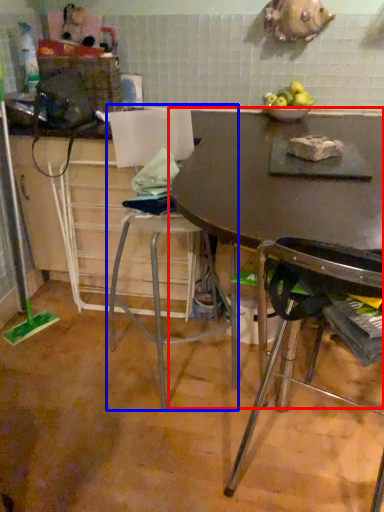
Question: Which object is closer to the camera taking this photo, table (highlighted by a red box) or chair (highlighted by a blue box)?

Choices:
 (A) table
 (B) chair

Answer: (A)